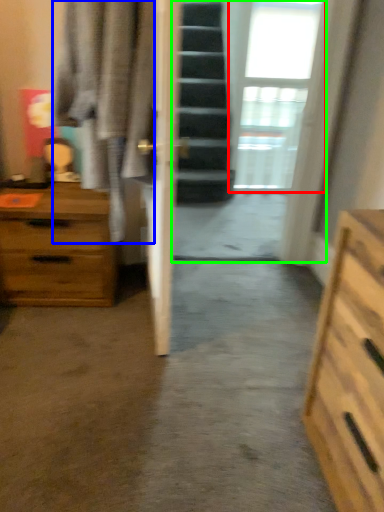
Question: Which is farther away from window (highlighted by a red box)? robe (highlighted by a blue box) or glass door (highlighted by a green box)?

Choices:
 (A) robe
 (B) glass door

Answer: (A)